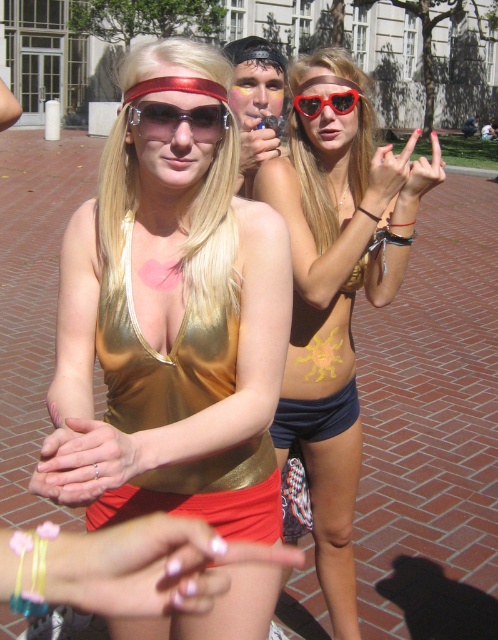
Between matte gold bikini top at center and metallic gold goggles at upper center, which one is positioned higher?

metallic gold goggles at upper center is higher up.

Looking at this image, which of these two, matte gold bikini top at center or metallic gold goggles at upper center, stands shorter?

With less height is metallic gold goggles at upper center.

The height and width of the screenshot is (640, 498). Describe the element at coordinates (337, 292) in the screenshot. I see `matte gold bikini top at center` at that location.

Where is `matte gold bikini top at center`? The height and width of the screenshot is (640, 498). matte gold bikini top at center is located at coordinates (337, 292).

Based on the photo, can you confirm if gold shiny tank top at center is positioned to the right of red plastic sunglasses at upper center?

In fact, gold shiny tank top at center is to the left of red plastic sunglasses at upper center.

Looking at this image, is gold shiny tank top at center wider than red plastic sunglasses at upper center?

Correct, the width of gold shiny tank top at center exceeds that of red plastic sunglasses at upper center.

Is point (95, 273) in front of point (314, 96)?

Yes, it is.

Image resolution: width=498 pixels, height=640 pixels. Identify the location of gold shiny tank top at center. (170, 321).

Is matte gold bikini top at center wider than red plastic sunglasses at upper center?

Yes, matte gold bikini top at center is wider than red plastic sunglasses at upper center.

Can you confirm if matte gold bikini top at center is taller than red plastic sunglasses at upper center?

Correct, matte gold bikini top at center is much taller as red plastic sunglasses at upper center.

Between point (325, 141) and point (335, 113), which one is positioned behind?

Positioned behind is point (325, 141).

Where is `matte gold bikini top at center`? The height and width of the screenshot is (640, 498). matte gold bikini top at center is located at coordinates (337, 292).